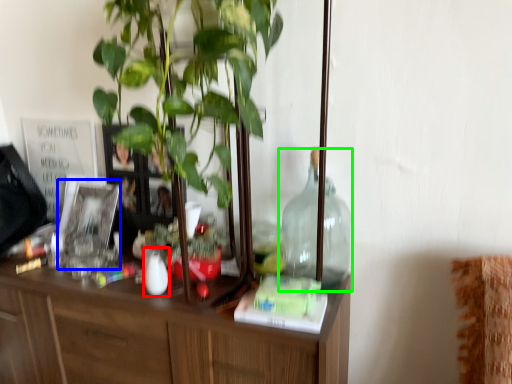
Question: Considering the real-world distances, which object is closest to vase (highlighted by a red box)? picture frame (highlighted by a blue box) or bottle (highlighted by a green box).

Choices:
 (A) picture frame
 (B) bottle

Answer: (A)